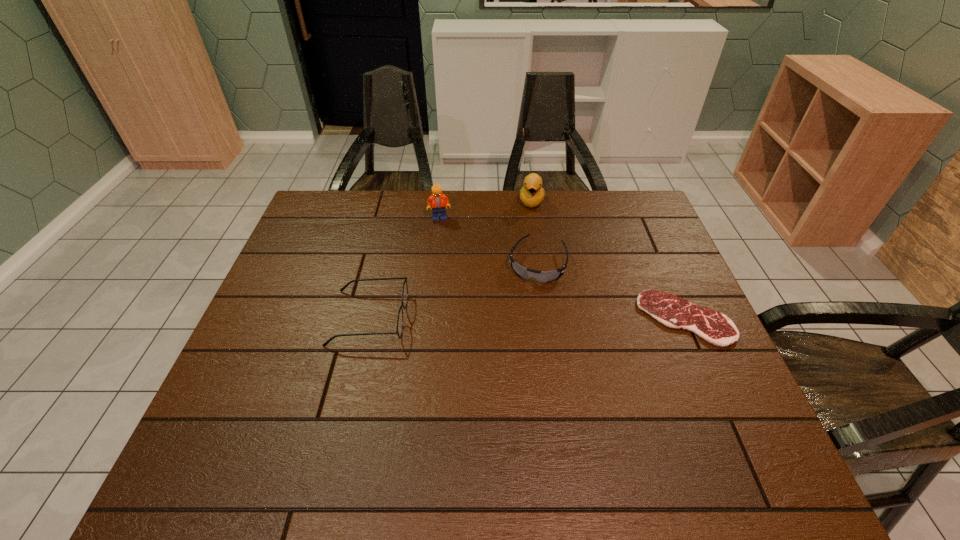
Image resolution: width=960 pixels, height=540 pixels. I want to click on vacant space located on the left of the rightmost object, so click(x=532, y=319).

Find the location of a particular element. blank area located on the front-facing side of the Lego is located at coordinates (475, 259).

Locate an element on the screen. free space located on the front-facing side of the Lego is located at coordinates (475, 259).

What are the coordinates of `vacant position located 0.260m on the front-facing side of the Lego` in the screenshot? It's located at (483, 269).

The height and width of the screenshot is (540, 960). I want to click on free space located 0.330m on the lenses of the fourth tallest object, so click(x=504, y=384).

I want to click on free space located on the lenses of the fourth tallest object, so click(528, 300).

Image resolution: width=960 pixels, height=540 pixels. I want to click on vacant space located 0.140m on the lenses of the fourth tallest object, so click(521, 322).

Identify the location of free location located facing forward on the farthest object. (524, 288).

What are the coordinates of `vacant space located facing forward on the farthest object` in the screenshot? It's located at (523, 294).

Where is `free space located facing forward on the farthest object`? free space located facing forward on the farthest object is located at coordinates (526, 265).